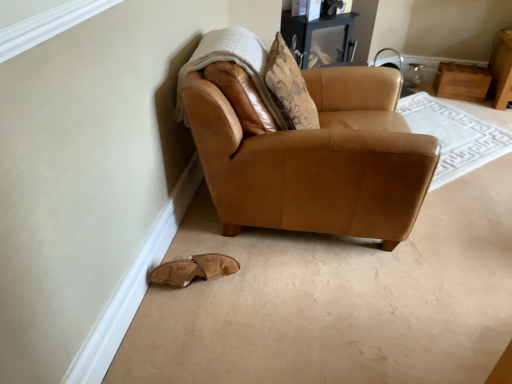
Question: In the image, is matte black entertainment center at upper center positioned in front of or behind saddle brown leather armchair at lower left?

Choices:
 (A) behind
 (B) front

Answer: (A)

Question: Is point (318, 21) closer or farther from the camera than point (365, 157)?

Choices:
 (A) farther
 (B) closer

Answer: (A)

Question: Which is nearer to the white textured blanket at upper left?

Choices:
 (A) saddle brown leather armchair at lower left
 (B) matte black entertainment center at upper center
 (C) tan suede slipper at lower left

Answer: (A)

Question: Which object is positioned farthest from the white textured blanket at upper left?

Choices:
 (A) saddle brown leather armchair at lower left
 (B) tan suede slipper at lower left
 (C) matte black entertainment center at upper center

Answer: (C)